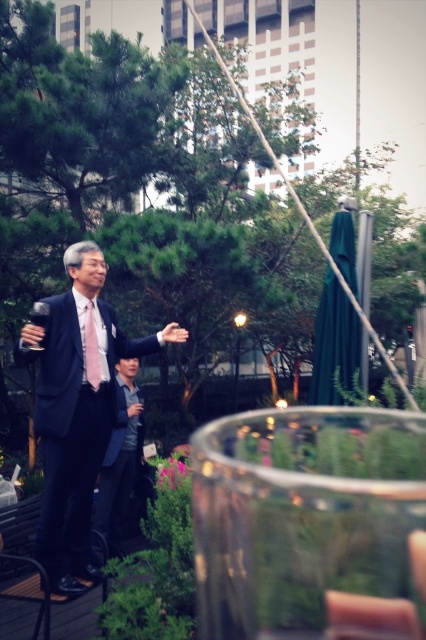
You are a photographer at the event and want to capture a clear photo of both the dark gray suit at center and the pink satin tie at center. Since the camera can only focus on one object at a time, which object should you focus on to ensure the taller object is in focus?

The dark gray suit at center is taller than the pink satin tie at center, so you should focus on the dark gray suit at center to ensure the taller object is in focus.

In the scene shown: You are standing at the origin point of the coordinate system in the image. You want to move towards the matte black suit at center. What direction should you move in to reach it?

The matte black suit at center is located at coordinates point (75, 412). Since you are at the origin point, you should move in the positive x and positive y direction to reach it.